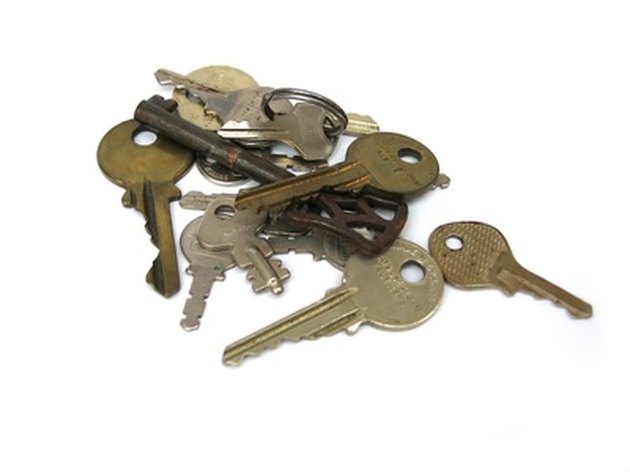
The width and height of the screenshot is (630, 472). Identify the location of keys. (145, 175), (201, 260), (218, 229), (360, 225), (401, 280), (467, 246), (407, 173), (307, 130), (358, 118), (238, 102).